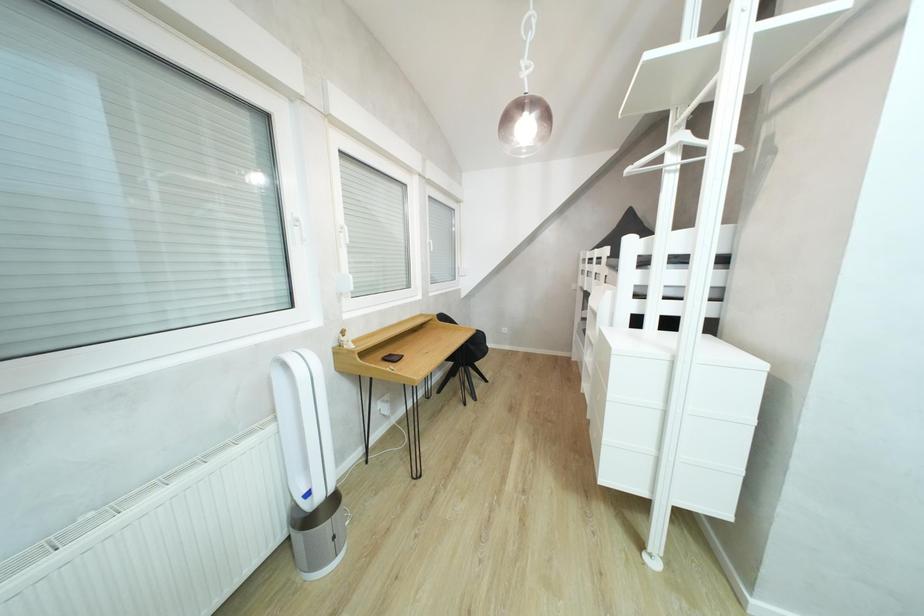
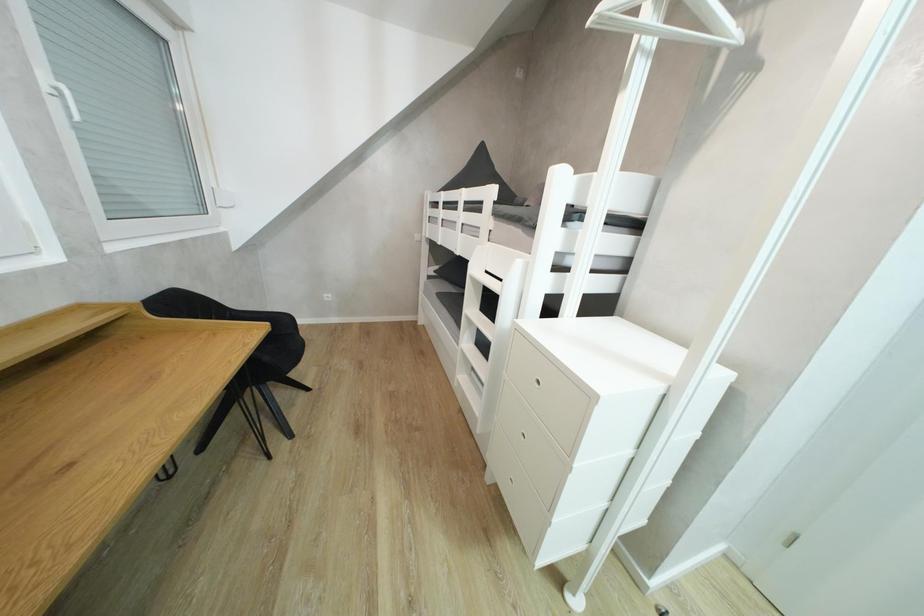
Question: The camera is either moving clockwise (left) or counter-clockwise (right) around the object. The first image is from the beginning of the video and the second image is from the end. Is the camera moving left or right when shooting the video?

Choices:
 (A) Left
 (B) Right

Answer: (A)